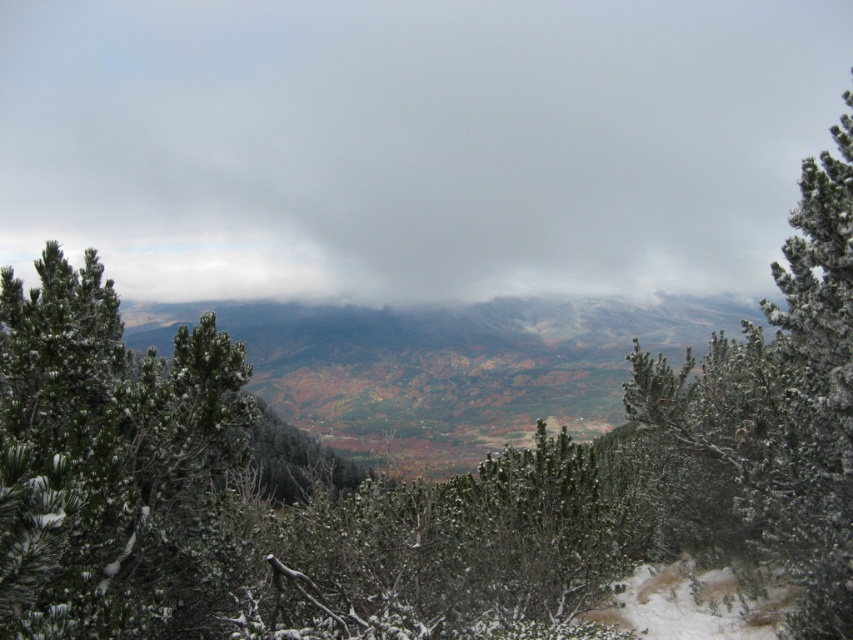
You are a hiker planning to take a photo of the white fluffy cloud at upper center and the white frosty pine at upper right. You want to ensure both are in focus. The camera you are using has a depth of field that can sharply focus objects within a 200 meter range. Will both objects be in focus at the same time?

The white fluffy cloud at upper center is 272.72 meters away from the white frosty pine at upper right. Since the distance between them exceeds the camera s 200 meter depth of field range, both objects cannot be in focus simultaneously.

You are a hiker planning to take a photo of the white fluffy cloud at upper center and the white frosty pine at upper right. Which object should you adjust your camera focus on first if you want both to be in clear view?

The white fluffy cloud at upper center is positioned on the left side of white frosty pine at upper right. Since the cloud is closer to the camera, you should focus on it first to ensure both are in clear view.